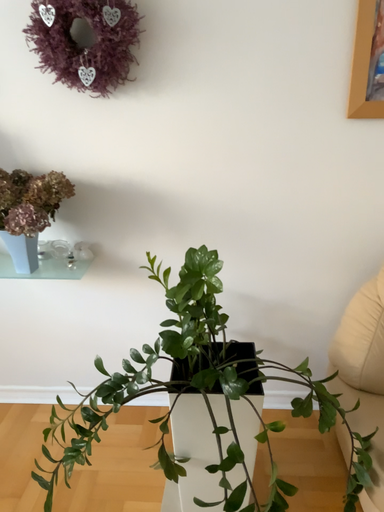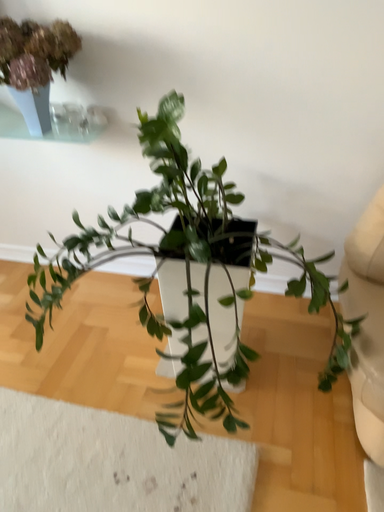
Question: Which way did the camera rotate in the video?

Choices:
 (A) rotated downward
 (B) rotated upward

Answer: (A)